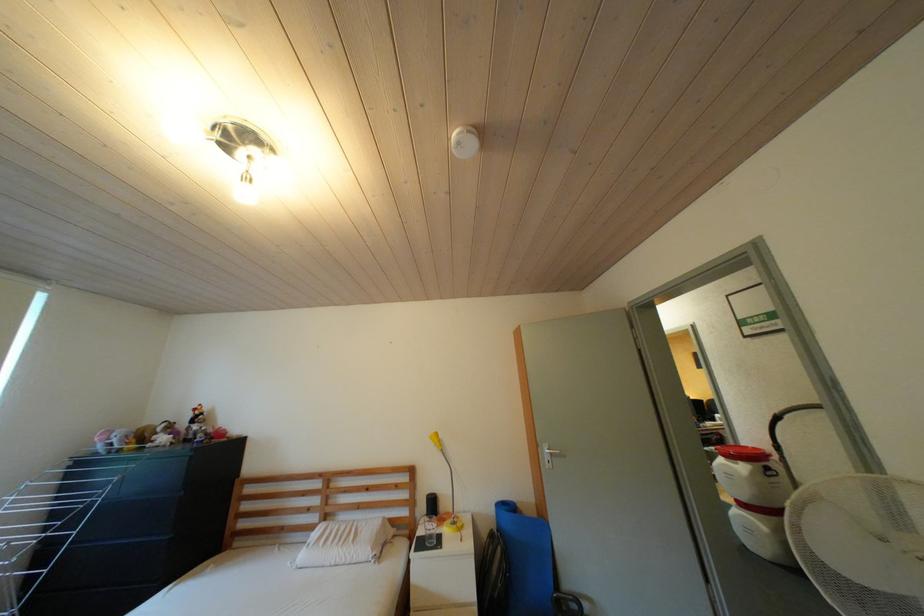
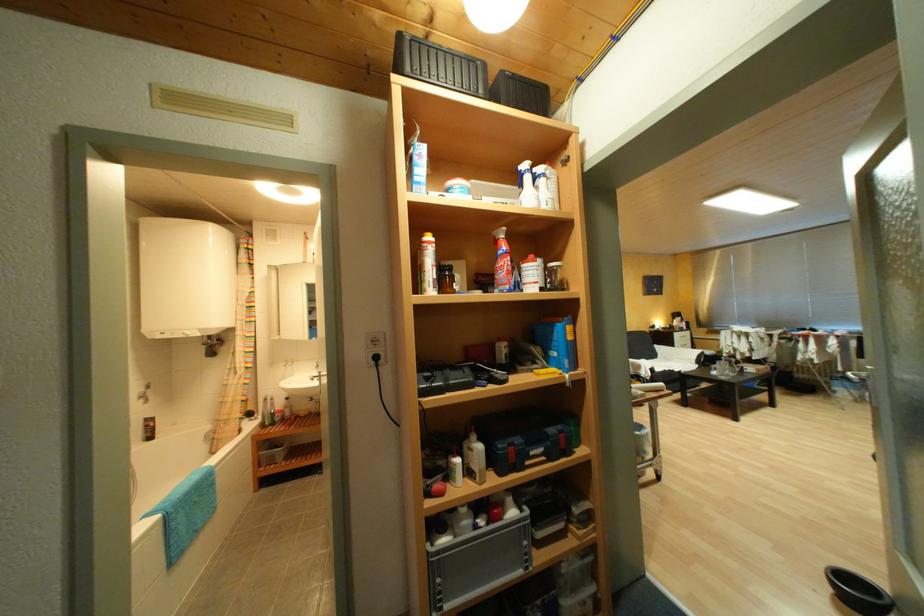
The images are taken continuously from a first-person perspective. In which direction are you moving?

The cameraman moved toward right, forward.